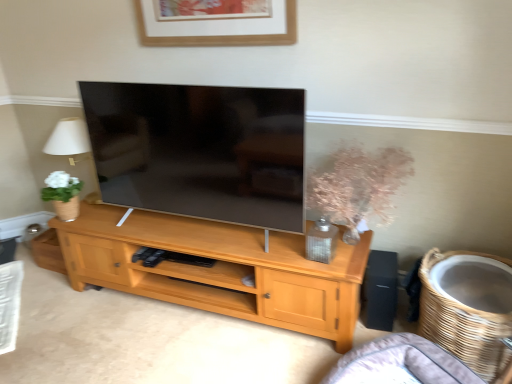
Find the location of a particular element. The height and width of the screenshot is (384, 512). translucent glass vase at center-right is located at coordinates (358, 186).

Where is `gray fabric couch at lower right`? gray fabric couch at lower right is located at coordinates (401, 363).

Where is `light wood cabinet at center`? The height and width of the screenshot is (384, 512). light wood cabinet at center is located at coordinates (218, 269).

What do you see at coordinates (380, 291) in the screenshot?
I see `black matte speaker at right` at bounding box center [380, 291].

You are a GUI agent. You are given a task and a screenshot of the screen. Output one action in this format:
    pyautogui.click(x=<x>, y=<y>)
    Task: Click on the translucent glass vase at center-right
    Image resolution: width=512 pixels, height=384 pixels.
    Given the screenshot: What is the action you would take?
    pyautogui.click(x=358, y=186)

In the scene shown: Are woven brown basket at lower right and light wood cabinet at center beside each other?

No, woven brown basket at lower right is not in contact with light wood cabinet at center.

How far apart are woven brown basket at lower right and light wood cabinet at center?

The distance of woven brown basket at lower right from light wood cabinet at center is 33.94 inches.

Is woven brown basket at lower right further to camera compared to light wood cabinet at center?

Yes, woven brown basket at lower right is behind light wood cabinet at center.

Is point (487, 350) positioned before point (200, 292)?

That is True.

Between gray fabric couch at lower right and woven brown basket at lower right, which one is positioned behind?

woven brown basket at lower right is more distant.

From the image's perspective, which is below, gray fabric couch at lower right or woven brown basket at lower right?

gray fabric couch at lower right, from the image's perspective.

Would you consider gray fabric couch at lower right to be distant from woven brown basket at lower right?

No.

From a real-world perspective, relative to woven brown basket at lower right, is gray fabric couch at lower right vertically above or below?

gray fabric couch at lower right is below woven brown basket at lower right.

Could you tell me if translucent glass vase at center-right is facing black matte speaker at right?

No, translucent glass vase at center-right does not turn towards black matte speaker at right.

Between point (340, 157) and point (365, 307), which one is positioned in front?

The point (340, 157) is more forward.

Considering the sizes of translucent glass vase at center-right and black matte speaker at right in the image, is translucent glass vase at center-right bigger or smaller than black matte speaker at right?

In the image, translucent glass vase at center-right appears to be larger than black matte speaker at right.

Is translucent glass vase at center-right turned away from wooden picture frame at upper center?

No, translucent glass vase at center-right's orientation is not away from wooden picture frame at upper center.

Which of these two, translucent glass vase at center-right or wooden picture frame at upper center, is wider?

translucent glass vase at center-right is wider.

Which of these two, translucent glass vase at center-right or wooden picture frame at upper center, stands shorter?

wooden picture frame at upper center.

Which object is positioned more to the left, translucent glass vase at center-right or wooden picture frame at upper center?

wooden picture frame at upper center is more to the left.

Does light wood cabinet at center have a smaller size compared to wooden picture frame at upper center?

No.

Is light wood cabinet at center surrounding wooden picture frame at upper center?

No, wooden picture frame at upper center is not a part of light wood cabinet at center.

Identify the location of shelf below the wooden picture frame at upper center (from a real-world perspective). (218, 269).

Choose the correct answer: Is black matte speaker at right inside wooden picture frame at upper center or outside it?

black matte speaker at right is not enclosed by wooden picture frame at upper center.

Is black matte speaker at right oriented towards wooden picture frame at upper center?

No, black matte speaker at right is not facing towards wooden picture frame at upper center.

From the image's perspective, is black matte speaker at right on wooden picture frame at upper center?

No, from the image's perspective, black matte speaker at right is not above wooden picture frame at upper center.

From a real-world perspective, is black matte speaker at right located beneath wooden picture frame at upper center?

Yes, from a real-world perspective, black matte speaker at right is beneath wooden picture frame at upper center.

Is gray fabric couch at lower right turned away from light wood cabinet at center?

gray fabric couch at lower right does not have its back to light wood cabinet at center.

Visually, is gray fabric couch at lower right positioned to the left or to the right of light wood cabinet at center?

Based on their positions, gray fabric couch at lower right is located to the right of light wood cabinet at center.

Consider the image. Considering the relative sizes of gray fabric couch at lower right and light wood cabinet at center in the image provided, is gray fabric couch at lower right taller than light wood cabinet at center?

Correct, gray fabric couch at lower right is much taller as light wood cabinet at center.

From a real-world perspective, who is located higher, gray fabric couch at lower right or light wood cabinet at center?

gray fabric couch at lower right is physically above.

The image size is (512, 384). Identify the location of basket on the right of light wood cabinet at center. (463, 322).

You are a GUI agent. You are given a task and a screenshot of the screen. Output one action in this format:
    pyautogui.click(x=<x>, y=<y>)
    Task: Click on the basket behind the gray fabric couch at lower right
    The image size is (512, 384).
    Given the screenshot: What is the action you would take?
    pyautogui.click(x=463, y=322)

When comparing their distances from black matte speaker at right, does wooden picture frame at upper center or translucent glass vase at center-right seem closer?

translucent glass vase at center-right is positioned closer to the anchor black matte speaker at right.

When comparing their distances from gray fabric couch at lower right, does wooden picture frame at upper center or translucent glass vase at center-right seem closer?

translucent glass vase at center-right is positioned closer to the anchor gray fabric couch at lower right.

Estimate the real-world distances between objects in this image. Which object is closer to translucent glass vase at center-right, light wood cabinet at center or wooden picture frame at upper center?

light wood cabinet at center.

From the picture: From the image, which object appears to be nearer to translucent glass vase at center-right, gray fabric couch at lower right or black matte speaker at right?

Among the two, black matte speaker at right is located nearer to translucent glass vase at center-right.

Estimate the real-world distances between objects in this image. Which object is closer to black matte speaker at right, light wood cabinet at center or woven brown basket at lower right?

woven brown basket at lower right is positioned closer to the anchor black matte speaker at right.

Based on their spatial positions, is translucent glass vase at center-right or black matte speaker at right closer to wooden picture frame at upper center?

translucent glass vase at center-right.

From the image, which object appears to be nearer to gray fabric couch at lower right, light wood cabinet at center or translucent glass vase at center-right?

Among the two, light wood cabinet at center is located nearer to gray fabric couch at lower right.

When comparing their distances from translucent glass vase at center-right, does wooden picture frame at upper center or gray fabric couch at lower right seem closer?

Based on the image, gray fabric couch at lower right appears to be nearer to translucent glass vase at center-right.

This screenshot has height=384, width=512. In order to click on floral arrangement between wooden picture frame at upper center and gray fabric couch at lower right from top to bottom in this screenshot , I will do `click(358, 186)`.

You are a GUI agent. You are given a task and a screenshot of the screen. Output one action in this format:
    pyautogui.click(x=<x>, y=<y>)
    Task: Click on the speaker between translucent glass vase at center-right and woven brown basket at lower right in the vertical direction
    
    Given the screenshot: What is the action you would take?
    pyautogui.click(x=380, y=291)

The width and height of the screenshot is (512, 384). Find the location of `speaker between wooden picture frame at upper center and light wood cabinet at center from top to bottom`. speaker between wooden picture frame at upper center and light wood cabinet at center from top to bottom is located at coordinates (380, 291).

Where is `speaker located between light wood cabinet at center and woven brown basket at lower right in the left-right direction`? The width and height of the screenshot is (512, 384). speaker located between light wood cabinet at center and woven brown basket at lower right in the left-right direction is located at coordinates (380, 291).